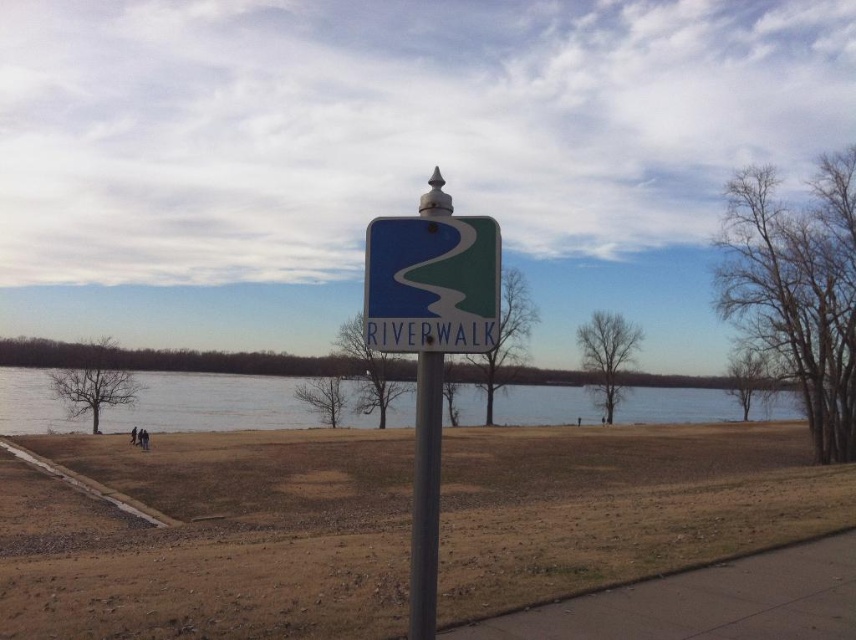
Question: Which point is farther to the camera?

Choices:
 (A) blue glossy sign at center
 (B) metallic pole at center

Answer: (A)

Question: Can you confirm if blue glossy sign at center is positioned to the left of metallic pole at center?

Choices:
 (A) yes
 (B) no

Answer: (B)

Question: Which point is farther from the camera taking this photo?

Choices:
 (A) (419, 416)
 (B) (367, 310)
 (C) (170, 394)
 (D) (489, 632)

Answer: (C)

Question: Among these objects, which one is farthest from the camera?

Choices:
 (A) blue glossy sign at center
 (B) gray asphalt pavement at lower right
 (C) blue water at center
 (D) metallic pole at center

Answer: (C)

Question: Can you confirm if gray asphalt pavement at lower right is positioned above metallic pole at center?

Choices:
 (A) yes
 (B) no

Answer: (B)

Question: Considering the relative positions of blue water at center and metallic pole at center in the image provided, where is blue water at center located with respect to metallic pole at center?

Choices:
 (A) left
 (B) right

Answer: (A)